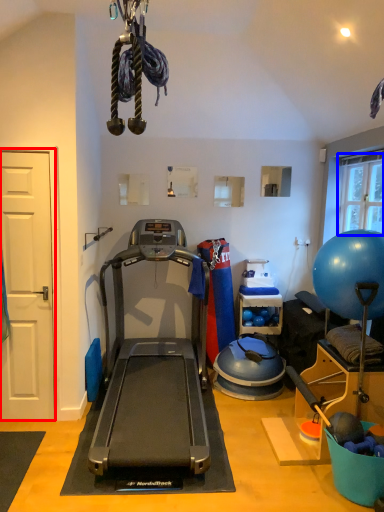
Question: Which object is closer to the camera taking this photo, door (highlighted by a red box) or window screen (highlighted by a blue box)?

Choices:
 (A) door
 (B) window screen

Answer: (A)